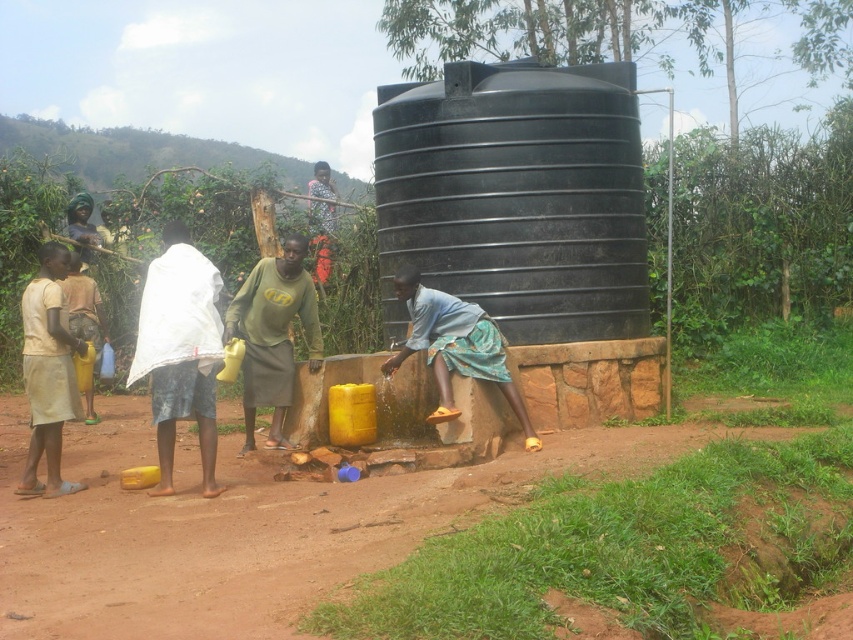
Question: Is light beige fabric shirt at left thinner than matte yellow jug at left?

Choices:
 (A) no
 (B) yes

Answer: (B)

Question: Is white cloth at left wider than green matte shirt at center?

Choices:
 (A) no
 (B) yes

Answer: (A)

Question: Which point is farther to the camera?

Choices:
 (A) light beige fabric shirt at left
 (B) green matte shirt at center
 (C) white cloth at left

Answer: (B)

Question: Which point is farther to the camera?

Choices:
 (A) green matte shirt at center
 (B) light beige fabric shirt at left
 (C) matte yellow jug at left
 (D) white cloth at left

Answer: (C)

Question: Which point is farther from the camera taking this photo?

Choices:
 (A) (105, 332)
 (B) (242, 300)
 (C) (210, 428)
 (D) (79, 353)

Answer: (A)

Question: Is green matte shirt at center in front of matte yellow jug at left?

Choices:
 (A) yes
 (B) no

Answer: (A)